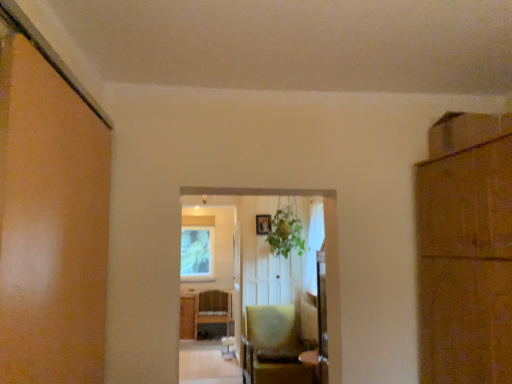
Question: Choose the correct answer: Is matte yellow chair at center inside wooden cabinet at center or outside it?

Choices:
 (A) outside
 (B) inside

Answer: (A)

Question: Does point (261, 311) appear closer or farther from the camera than point (222, 294)?

Choices:
 (A) closer
 (B) farther

Answer: (A)

Question: Estimate the real-world distances between objects in this image. Which object is closer to the wooden cabinet at center?

Choices:
 (A) matte yellow chair at center
 (B) white matte window screen at upper center
 (C) brown cardboard cabinet at right
 (D) green leafy plant at center
 (E) wooden picture frame at center

Answer: (B)

Question: Estimate the real-world distances between objects in this image. Which object is closer to the green leafy plant at center?

Choices:
 (A) white matte window screen at upper center
 (B) matte yellow chair at center
 (C) brown cardboard cabinet at right
 (D) wooden cabinet at center
 (E) wooden picture frame at center

Answer: (E)